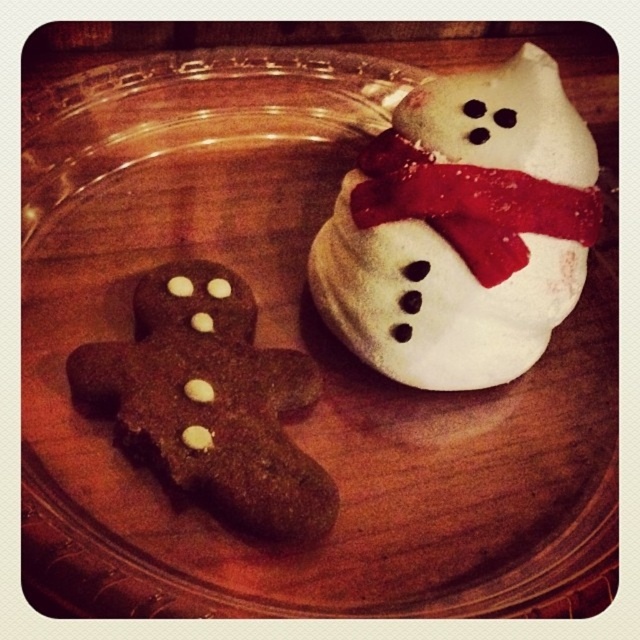
Question: Does white frosted cookie at upper right lie behind brown matte gingerbread man at left?

Choices:
 (A) yes
 (B) no

Answer: (A)

Question: Where is white frosted cookie at upper right located in relation to brown matte gingerbread man at left in the image?

Choices:
 (A) right
 (B) left

Answer: (A)

Question: Which object is closer to the camera taking this photo?

Choices:
 (A) white frosted cookie at upper right
 (B) red fabric scarf at upper right
 (C) brown matte gingerbread man at left

Answer: (C)

Question: Which of the following is the closest to the observer?

Choices:
 (A) (369, 157)
 (B) (572, 202)
 (C) (120, 408)

Answer: (C)

Question: Does white frosted cookie at upper right appear on the right side of red fabric scarf at upper right?

Choices:
 (A) yes
 (B) no

Answer: (B)

Question: Among these objects, which one is farthest from the camera?

Choices:
 (A) red fabric scarf at upper right
 (B) brown matte gingerbread man at left

Answer: (A)